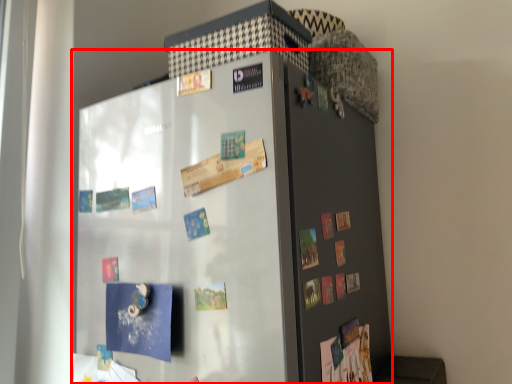
Question: Observing the image, what is the correct spatial positioning of refrigerator (annotated by the red box) in reference to door?

Choices:
 (A) right
 (B) left

Answer: (B)